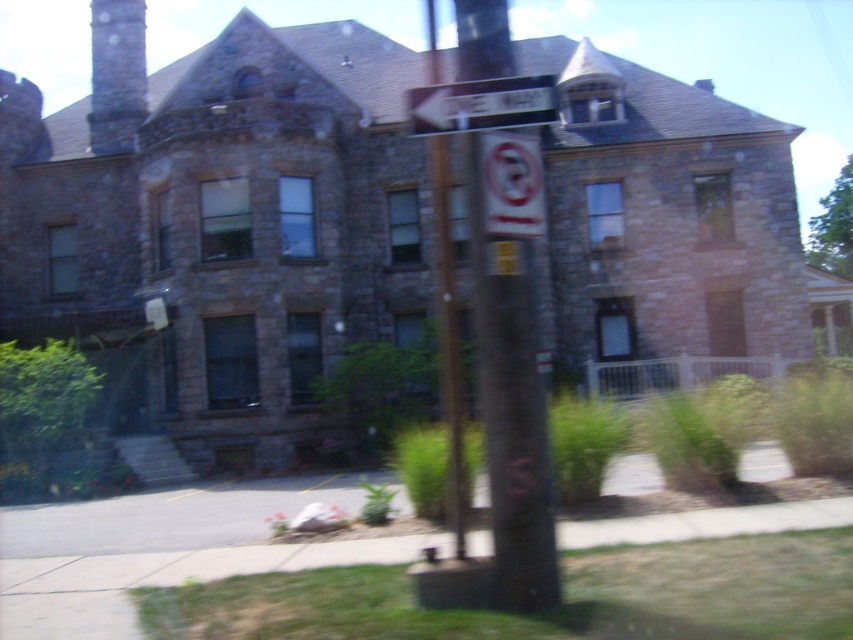
Between dark brown wood post at center and white plastic sign at upper center, which one is positioned lower?

dark brown wood post at center is lower down.

Does dark brown wood post at center have a smaller size compared to white plastic sign at upper center?

Incorrect, dark brown wood post at center is not smaller in size than white plastic sign at upper center.

Is point (469, 77) closer to viewer compared to point (495, 81)?

No, (469, 77) is behind (495, 81).

Where is `dark brown wood post at center`? Image resolution: width=853 pixels, height=640 pixels. dark brown wood post at center is located at coordinates (511, 410).